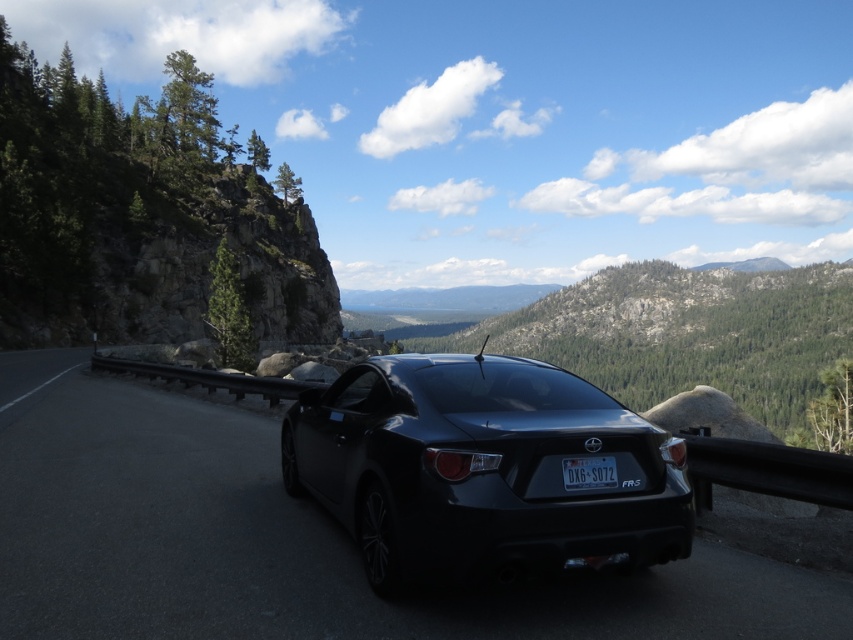
You are a photographer wanting to capture the black glossy car at center and the black plastic license plate at center in a single shot. Which object should you focus on first if you want to ensure both are in sharp focus?

The black glossy car at center is taller than the black plastic license plate at center, so you should focus on the black glossy car at center first to ensure both are in sharp focus.

Consider the image. You are a photographer positioned on the mountain road and want to capture both the black glossy car at center and the glossy black car at center in a single shot. Which car should you adjust your camera angle to include first if they are not both in frame?

The black glossy car at center is to the left of glossy black car at center, so you should adjust your camera angle to include the black glossy car at center first as it is positioned further to the left.